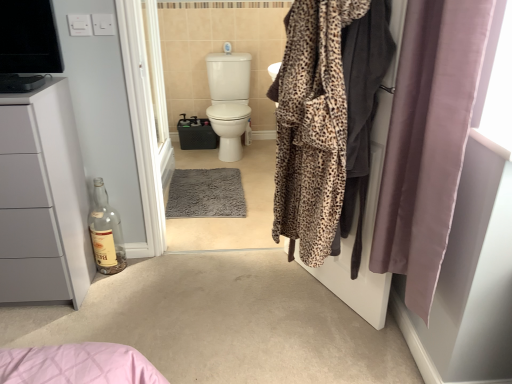
You are a GUI agent. You are given a task and a screenshot of the screen. Output one action in this format:
    pyautogui.click(x=<x>, y=<y>)
    Task: Click on the vacant area that lies to the right of clear glass bottle at lower left
    This screenshot has width=512, height=384.
    Given the screenshot: What is the action you would take?
    pyautogui.click(x=141, y=269)